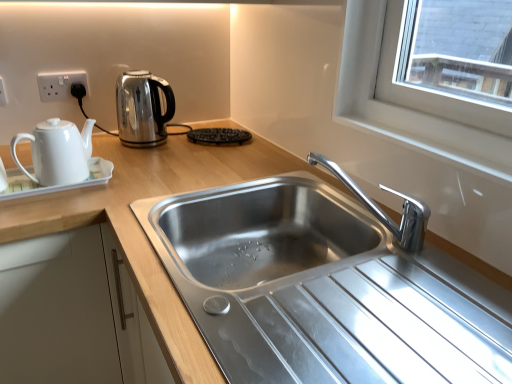
How much space does white plastic socket at upper left, which is counted as the second electric outlet, starting from the front, occupy horizontally?

white plastic socket at upper left, which is counted as the second electric outlet, starting from the front, is 0.63 inches wide.

Identify the location of chrome metallic faucet at center. This screenshot has width=512, height=384. (383, 211).

Locate an element on the screen. satin silver kettle at upper left, the 2th kettle in the front-to-back sequence is located at coordinates (142, 109).

Describe the element at coordinates (219, 135) in the screenshot. This screenshot has width=512, height=384. I see `black textured waffle iron at center` at that location.

Image resolution: width=512 pixels, height=384 pixels. Identify the location of stainless steel sink at center. (142, 230).

Measure the distance between point [3,83] and camera.

4.32 feet.

Identify the location of white plastic socket at upper left, which appears as the first electric outlet when viewed from the right. Image resolution: width=512 pixels, height=384 pixels. (59, 85).

Locate an element on the screen. This screenshot has height=384, width=512. the 2nd electric outlet positioned above the satin silver kettle at upper left, which appears as the first kettle when viewed from the back (from a real-world perspective) is located at coordinates (59, 85).

Is the depth of white plastic socket at upper left, which appears as the first electric outlet when viewed from the right, less than that of satin silver kettle at upper left, the 2th kettle in the front-to-back sequence?

That is False.

Looking at this image, which is more to the right, white plastic socket at upper left, placed as the first electric outlet when sorted from back to front, or satin silver kettle at upper left, which appears as the first kettle when viewed from the back?

From the viewer's perspective, satin silver kettle at upper left, which appears as the first kettle when viewed from the back, appears more on the right side.

Considering the relative sizes of white plastic socket at upper left, which appears as the first electric outlet when viewed from the right, and satin silver kettle at upper left, the 2th kettle in the front-to-back sequence, in the image provided, is white plastic socket at upper left, which appears as the first electric outlet when viewed from the right, bigger than satin silver kettle at upper left, the 2th kettle in the front-to-back sequence,?

No.

How much distance is there between black textured waffle iron at center and chrome metallic faucet at center?

black textured waffle iron at center and chrome metallic faucet at center are 22.21 inches apart from each other.

Considering the relative sizes of black textured waffle iron at center and chrome metallic faucet at center in the image provided, is black textured waffle iron at center smaller than chrome metallic faucet at center?

Yes.

Considering the sizes of objects black textured waffle iron at center and chrome metallic faucet at center in the image provided, who is taller, black textured waffle iron at center or chrome metallic faucet at center?

With more height is chrome metallic faucet at center.

Is black textured waffle iron at center not inside chrome metallic faucet at center?

Yes, black textured waffle iron at center is outside of chrome metallic faucet at center.

Is white glossy teapot at left, the 1th kettle from the front, in front of or behind stainless steel sink at center in the image?

white glossy teapot at left, the 1th kettle from the front, is positioned farther from the viewer than stainless steel sink at center.

From the image's perspective, is white glossy teapot at left, arranged as the second kettle when viewed from the back, positioned above or below stainless steel sink at center?

white glossy teapot at left, arranged as the second kettle when viewed from the back, is above stainless steel sink at center.

From a real-world perspective, between white glossy teapot at left, the 1th kettle from the front, and stainless steel sink at center, who is vertically lower?

stainless steel sink at center, from a real-world perspective.

Is white plastic socket at upper left, placed as the first electric outlet when sorted from back to front, in contact with black textured waffle iron at center?

No, white plastic socket at upper left, placed as the first electric outlet when sorted from back to front, is not making contact with black textured waffle iron at center.

Choose the correct answer: Is white plastic socket at upper left, which ranks as the second electric outlet in left-to-right order, inside black textured waffle iron at center or outside it?

The correct answer is: outside.

How many degrees apart are the facing directions of white plastic socket at upper left, which appears as the first electric outlet when viewed from the right, and black textured waffle iron at center?

The angle between the facing direction of white plastic socket at upper left, which appears as the first electric outlet when viewed from the right, and the facing direction of black textured waffle iron at center is 2.19 degrees.

Locate an element on the screen. Image resolution: width=512 pixels, height=384 pixels. appliance located underneath the white plastic electric outlet at upper left, acting as the 1th electric outlet starting from the front (from a real-world perspective) is located at coordinates (219, 135).

Which point is more distant from viewer, [189,134] or [3,103]?

The point [189,134] is more distant.

From the image's perspective, is black textured waffle iron at center on top of white plastic electric outlet at upper left, the second electric outlet viewed from the right?

No.

Is white plastic socket at upper left, which is counted as the second electric outlet, starting from the front, not inside white glossy teapot at left, arranged as the second kettle when viewed from the back?

Absolutely, white plastic socket at upper left, which is counted as the second electric outlet, starting from the front, is external to white glossy teapot at left, arranged as the second kettle when viewed from the back.

How much distance is there between white plastic socket at upper left, which is counted as the second electric outlet, starting from the front, and white glossy teapot at left, the 1th kettle from the front?

They are 15.84 inches apart.

Is white plastic socket at upper left, placed as the first electric outlet when sorted from back to front, far from white glossy teapot at left, the 1th kettle from the front?

white plastic socket at upper left, placed as the first electric outlet when sorted from back to front, is actually quite close to white glossy teapot at left, the 1th kettle from the front.

Which is less distant, (76, 74) or (38, 152)?

Point (76, 74) is farther from the camera than point (38, 152).

Which is more to the right, chrome metallic faucet at center or stainless steel sink at center?

Positioned to the right is chrome metallic faucet at center.

Can you confirm if chrome metallic faucet at center is taller than stainless steel sink at center?

Incorrect, the height of chrome metallic faucet at center is not larger of that of stainless steel sink at center.

Would you say chrome metallic faucet at center is inside or outside stainless steel sink at center?

chrome metallic faucet at center is not enclosed by stainless steel sink at center.

Is chrome metallic faucet at center wider or thinner than stainless steel sink at center?

In the image, chrome metallic faucet at center appears to be more narrow than stainless steel sink at center.

Locate an element on the screen. Image resolution: width=512 pixels, height=384 pixels. the 1st kettle in front of the white plastic socket at upper left, which is counted as the second electric outlet, starting from the front is located at coordinates (142, 109).

At what (x,y) coordinates should I click in order to perform the action: click on appliance that is behind the chrome metallic faucet at center. Please return your answer as a coordinate pair (x, y). Looking at the image, I should click on (219, 135).

Estimate the real-world distances between objects in this image. Which object is closer to stainless steel sink at center, white plastic socket at upper left, placed as the first electric outlet when sorted from back to front, or white plastic electric outlet at upper left, which ranks as the 1th electric outlet in left-to-right order?

white plastic socket at upper left, placed as the first electric outlet when sorted from back to front, lies closer to stainless steel sink at center than the other object.

When comparing their distances from stainless steel sink at center, does black textured waffle iron at center or chrome metallic faucet at center seem closer?

Among the two, black textured waffle iron at center is located nearer to stainless steel sink at center.

Considering their positions, is white glossy teapot at left, the 1th kettle from the front, positioned closer to white plastic electric outlet at upper left, the second electric outlet viewed from the right, than black textured waffle iron at center?

white glossy teapot at left, the 1th kettle from the front, lies closer to white plastic electric outlet at upper left, the second electric outlet viewed from the right, than the other object.

Looking at the image, which one is located closer to white plastic electric outlet at upper left, positioned as the second electric outlet in back-to-front order, white glossy teapot at left, arranged as the second kettle when viewed from the back, or satin silver kettle at upper left, the 2th kettle in the front-to-back sequence?

The object closer to white plastic electric outlet at upper left, positioned as the second electric outlet in back-to-front order, is satin silver kettle at upper left, the 2th kettle in the front-to-back sequence.

Considering their positions, is stainless steel sink at center positioned further to white glossy teapot at left, arranged as the second kettle when viewed from the back, than satin silver kettle at upper left, which appears as the first kettle when viewed from the back?

Based on the image, satin silver kettle at upper left, which appears as the first kettle when viewed from the back, appears to be further to white glossy teapot at left, arranged as the second kettle when viewed from the back.

Based on their spatial positions, is white plastic electric outlet at upper left, which ranks as the 1th electric outlet in left-to-right order, or white glossy teapot at left, the 1th kettle from the front, further from satin silver kettle at upper left, which appears as the first kettle when viewed from the back?

Based on the image, white plastic electric outlet at upper left, which ranks as the 1th electric outlet in left-to-right order, appears to be further to satin silver kettle at upper left, which appears as the first kettle when viewed from the back.

Which object lies further to the anchor point white plastic socket at upper left, which ranks as the second electric outlet in left-to-right order, stainless steel sink at center or white plastic electric outlet at upper left, acting as the 1th electric outlet starting from the front?

stainless steel sink at center is positioned further to the anchor white plastic socket at upper left, which ranks as the second electric outlet in left-to-right order.

From the image, which object appears to be farther from white plastic electric outlet at upper left, the second electric outlet viewed from the right, stainless steel sink at center or black textured waffle iron at center?

Among the two, stainless steel sink at center is located further to white plastic electric outlet at upper left, the second electric outlet viewed from the right.

Locate an element on the screen. Image resolution: width=512 pixels, height=384 pixels. electric outlet between white glossy teapot at left, the 1th kettle from the front, and white plastic socket at upper left, placed as the first electric outlet when sorted from back to front, from front to back is located at coordinates (2, 94).

You are a GUI agent. You are given a task and a screenshot of the screen. Output one action in this format:
    pyautogui.click(x=<x>, y=<y>)
    Task: Click on the electric outlet located between white plastic electric outlet at upper left, which ranks as the 1th electric outlet in left-to-right order, and satin silver kettle at upper left, the 2th kettle in the front-to-back sequence, in the left-right direction
    
    Given the screenshot: What is the action you would take?
    pyautogui.click(x=59, y=85)

You are a GUI agent. You are given a task and a screenshot of the screen. Output one action in this format:
    pyautogui.click(x=<x>, y=<y>)
    Task: Click on the kettle between white plastic electric outlet at upper left, positioned as the second electric outlet in back-to-front order, and satin silver kettle at upper left, the 2th kettle in the front-to-back sequence, in the horizontal direction
    This screenshot has height=384, width=512.
    Given the screenshot: What is the action you would take?
    pyautogui.click(x=57, y=152)

The height and width of the screenshot is (384, 512). Find the location of `electric outlet positioned between stainless steel sink at center and satin silver kettle at upper left, the 2th kettle in the front-to-back sequence, from near to far`. electric outlet positioned between stainless steel sink at center and satin silver kettle at upper left, the 2th kettle in the front-to-back sequence, from near to far is located at coordinates (2, 94).